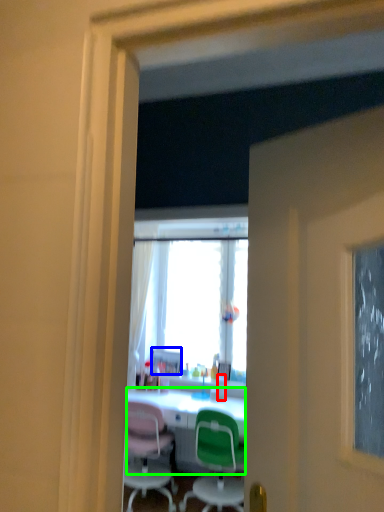
Question: Estimate the real-world distances between objects in this image. Which object is closer to bottle (highlighted by a red box), picture frame (highlighted by a blue box) or desk (highlighted by a green box)?

Choices:
 (A) picture frame
 (B) desk

Answer: (B)